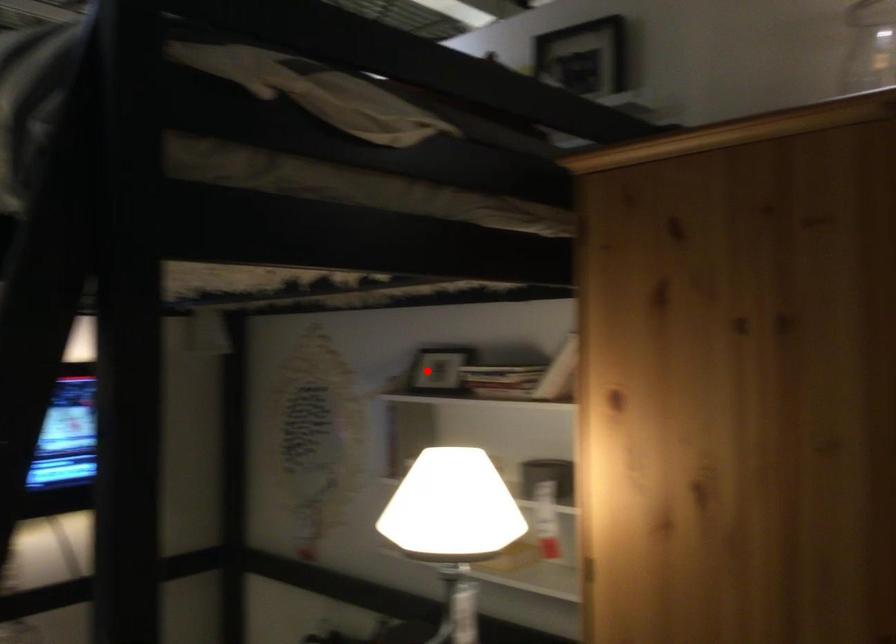
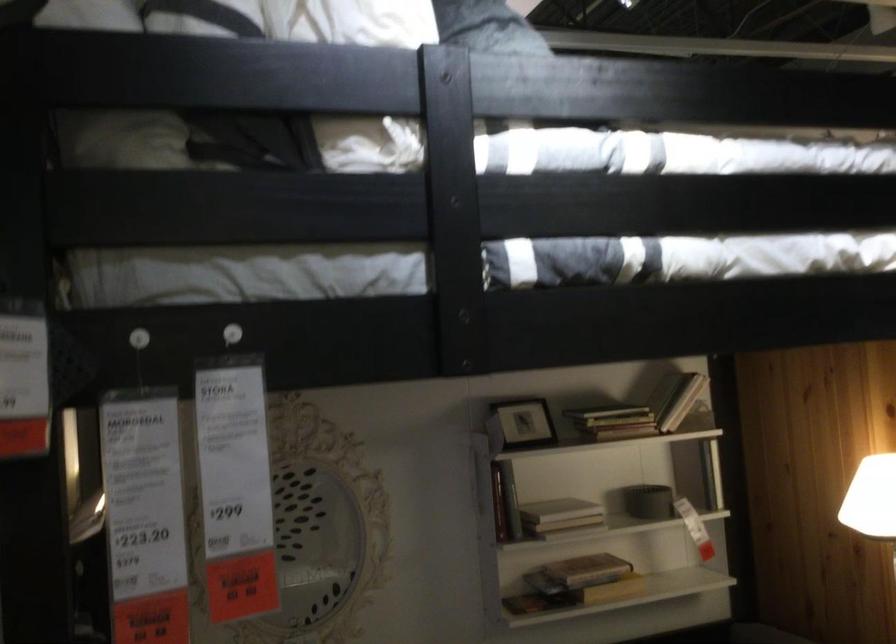
In the second image, find the point that corresponds to the highlighted location in the first image.

(522, 422)